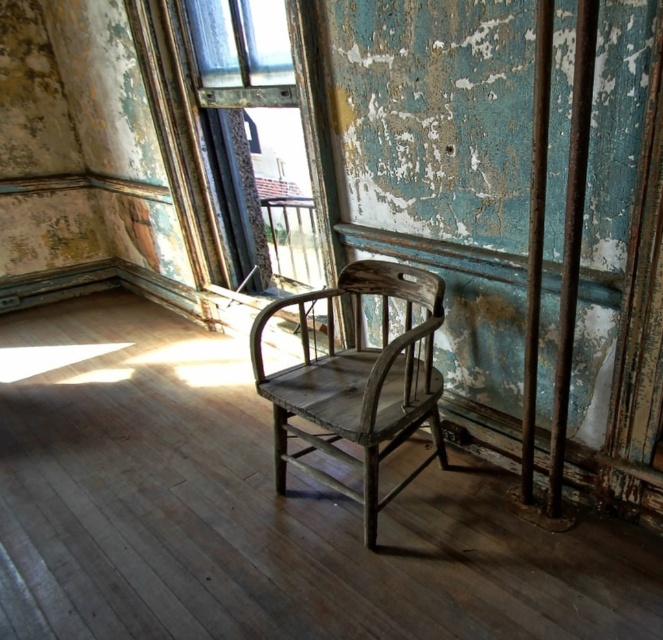
Question: Observing the image, what is the correct spatial positioning of wooden frame at center in reference to weathered wood chair at center?

Choices:
 (A) below
 (B) above

Answer: (B)

Question: Which point is farther from the camera taking this photo?

Choices:
 (A) (292, 371)
 (B) (166, 154)

Answer: (B)

Question: Among these objects, which one is nearest to the camera?

Choices:
 (A) weathered wood chair at center
 (B) wooden frame at center

Answer: (A)

Question: Is wooden frame at center to the right of weathered wood chair at center from the viewer's perspective?

Choices:
 (A) no
 (B) yes

Answer: (A)

Question: Is wooden frame at center bigger than weathered wood chair at center?

Choices:
 (A) no
 (B) yes

Answer: (B)